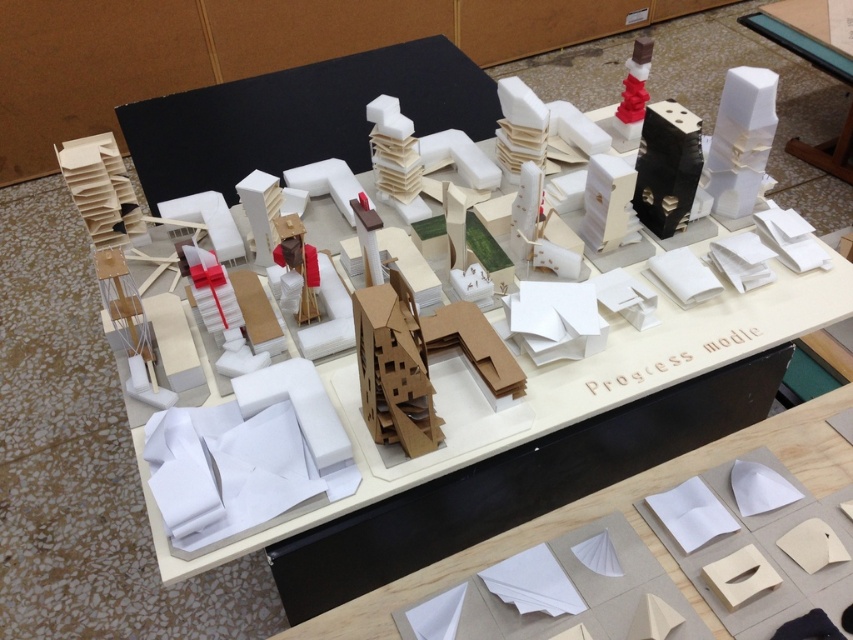
Question: Which point is farther to the camera?

Choices:
 (A) (815, 12)
 (B) (608, 500)

Answer: (A)

Question: Is white paper at center to the right of white cardboard table at center from the viewer's perspective?

Choices:
 (A) no
 (B) yes

Answer: (A)

Question: Does white paper at center appear on the left side of white cardboard table at center?

Choices:
 (A) yes
 (B) no

Answer: (A)

Question: Does white paper at center have a greater width compared to white cardboard table at center?

Choices:
 (A) yes
 (B) no

Answer: (A)